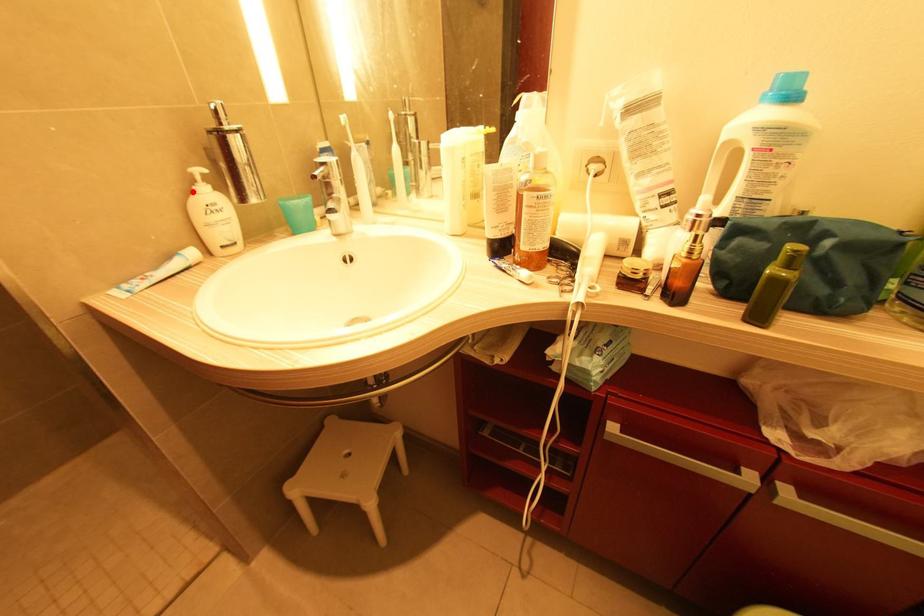
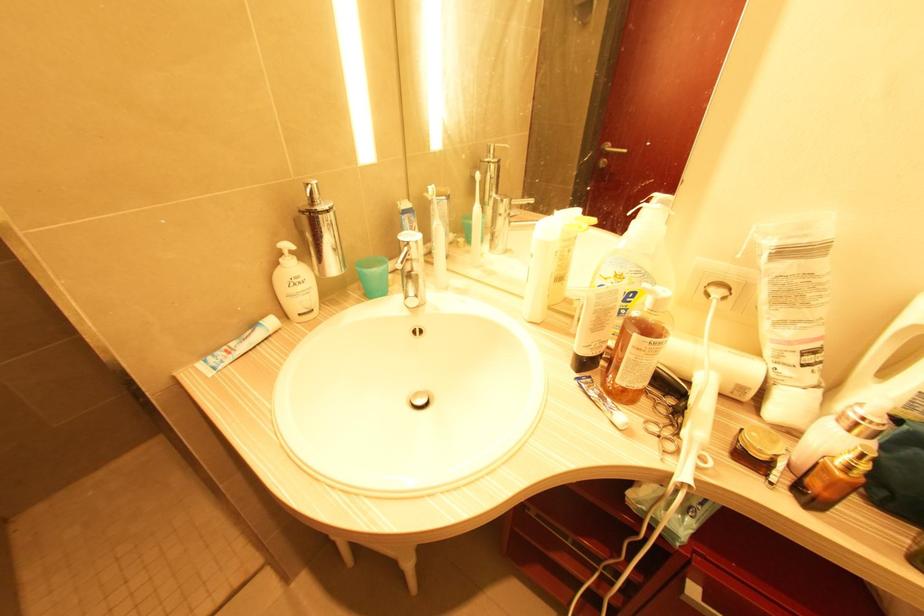
Locate, in the second image, the point that corresponds to the highlighted location in the first image.

(280, 265)